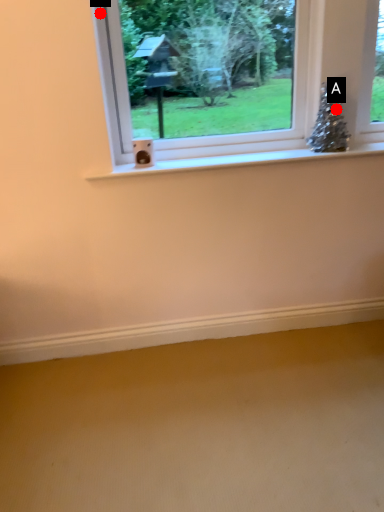
Question: Two points are circled on the image, labeled by A and B beside each circle. Which of the following is the closest to the observer?

Choices:
 (A) A is closer
 (B) B is closer

Answer: (B)